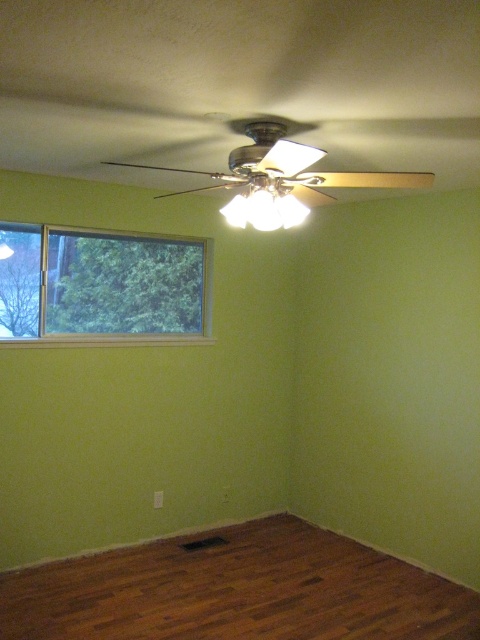
Question: Does brown wood floor at lower center have a greater width compared to clear glass window at left?

Choices:
 (A) yes
 (B) no

Answer: (A)

Question: Which object appears closest to the camera in this image?

Choices:
 (A) clear glass window at left
 (B) brown wood floor at lower center

Answer: (B)

Question: Can you confirm if brown wood floor at lower center is thinner than clear glass window at left?

Choices:
 (A) yes
 (B) no

Answer: (B)

Question: Can you confirm if brown wood floor at lower center is wider than clear glass window at left?

Choices:
 (A) yes
 (B) no

Answer: (A)